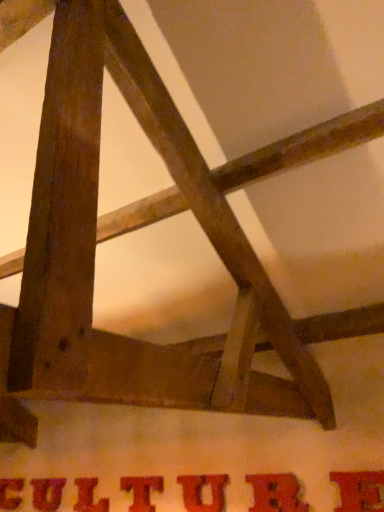
Question: From a real-world perspective, is matte red letter at center, which is the second letter in right-to-left order, above or below matte brown letter t at center, which appears as the 4th letter when viewed from the right?

Choices:
 (A) above
 (B) below

Answer: (B)

Question: Considering the positions of matte red letter at center, which is the sixth letter from left to right, and matte brown letter t at center, the 4th letter in the left-to-right sequence, in the image, is matte red letter at center, which is the sixth letter from left to right, bigger or smaller than matte brown letter t at center, the 4th letter in the left-to-right sequence,?

Choices:
 (A) big
 (B) small

Answer: (A)

Question: Which of these objects is positioned closest to the matte brown letter t at center, the 4th letter in the left-to-right sequence?

Choices:
 (A) matte red letter at center, which is the second letter in right-to-left order
 (B) matte brown letter at center, which is the first letter from left to right
 (C) matte red letter at center, which is the third letter in left-to-right order
 (D) matte red letter at center, which is counted as the fifth letter, starting from the left
 (E) matte red letter at center, marked as the second letter in a left-to-right arrangement

Answer: (C)

Question: Estimate the real-world distances between objects in this image. Which object is closer to the matte red letter at center, the sixth letter positioned from the right?

Choices:
 (A) matte brown letter t at center, which appears as the 4th letter when viewed from the right
 (B) matte red letter at center, which is the sixth letter from left to right
 (C) matte red letter at center, which is the third letter in right-to-left order
 (D) matte brown letter at center, which is the first letter from left to right
 (E) matte red letter at center, marked as the fifth letter in a right-to-left arrangement

Answer: (D)